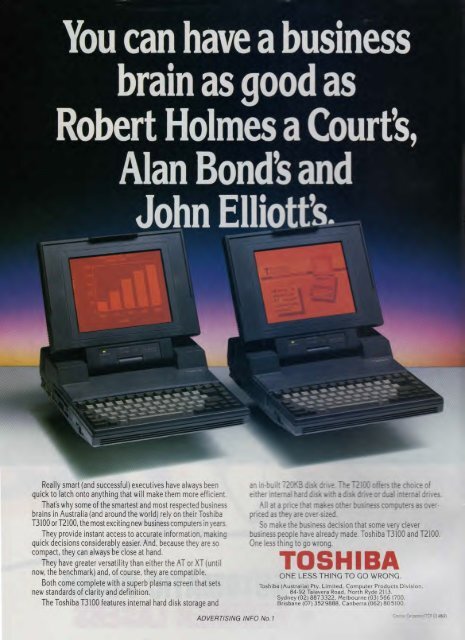
In order to click on shadows underneath each computer in this screenshot , I will do `click(151, 457)`, `click(337, 445)`.